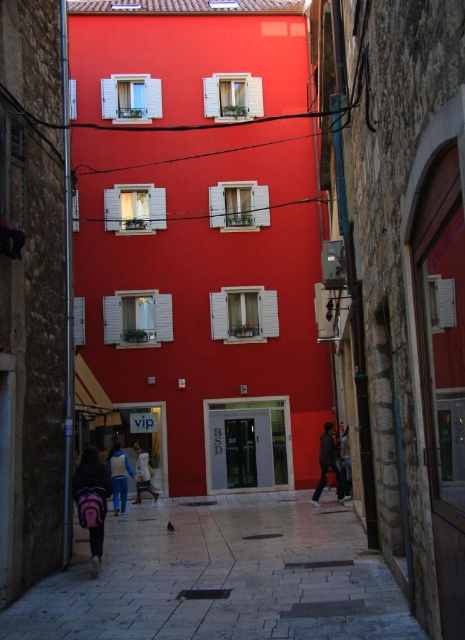
Between dark gray fabric jacket at lower right and white fabric coat at center, which one has less height?

Standing shorter between the two is dark gray fabric jacket at lower right.

Is dark gray fabric jacket at lower right positioned in front of white fabric coat at center?

Yes.

Is point (314, 490) closer to viewer compared to point (141, 467)?

That is False.

In order to click on dark gray fabric jacket at lower right in this screenshot , I will do `click(329, 464)`.

The height and width of the screenshot is (640, 465). What do you see at coordinates (92, 500) in the screenshot?
I see `pink fabric backpack at lower left` at bounding box center [92, 500].

Is pink fabric backpack at lower left smaller than white fabric coat at center?

Yes.

In order to click on pink fabric backpack at lower left in this screenshot , I will do `click(92, 500)`.

I want to click on pink fabric backpack at lower left, so click(x=92, y=500).

Can you confirm if white fabric coat at center is wider than dark blue jeans at center?

Yes, white fabric coat at center is wider than dark blue jeans at center.

Looking at this image, between white fabric coat at center and dark blue jeans at center, which one appears on the left side from the viewer's perspective?

white fabric coat at center

You are a GUI agent. You are given a task and a screenshot of the screen. Output one action in this format:
    pyautogui.click(x=<x>, y=<y>)
    Task: Click on the white fabric coat at center
    This screenshot has width=465, height=640.
    Given the screenshot: What is the action you would take?
    pyautogui.click(x=143, y=474)

In order to click on white fabric coat at center in this screenshot , I will do `click(143, 474)`.